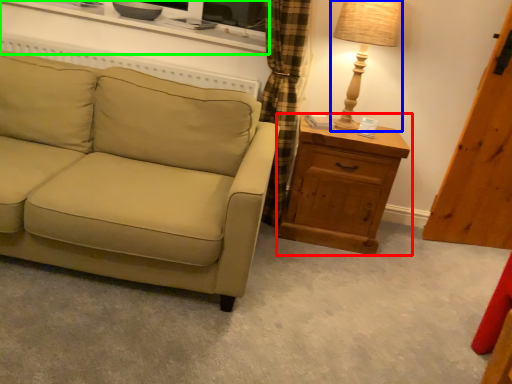
Question: Which is farther away from chest of drawers (highlighted by a red box)? table lamp (highlighted by a blue box) or entertainment center (highlighted by a green box)?

Choices:
 (A) table lamp
 (B) entertainment center

Answer: (B)